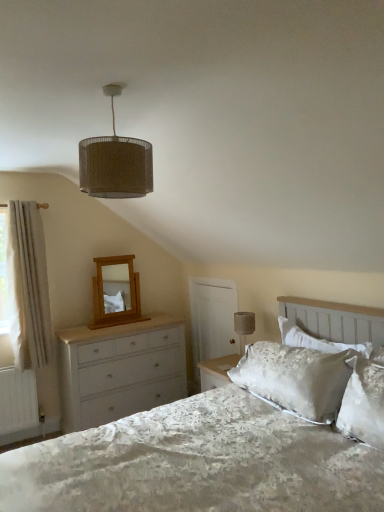
Question: Should I look upward or downward to see white fluffy curtain at left?

Choices:
 (A) up
 (B) down

Answer: (B)

Question: Is the position of light oak wooden mirror at upper left less distant than that of matte gray fabric at upper right?

Choices:
 (A) yes
 (B) no

Answer: (B)

Question: Considering the relative positions of light oak wooden mirror at upper left and matte gray fabric at upper right in the image provided, is light oak wooden mirror at upper left to the right of matte gray fabric at upper right from the viewer's perspective?

Choices:
 (A) yes
 (B) no

Answer: (B)

Question: From a real-world perspective, is light oak wooden mirror at upper left below matte gray fabric at upper right?

Choices:
 (A) no
 (B) yes

Answer: (A)

Question: From the image's perspective, is light oak wooden mirror at upper left on top of matte gray fabric at upper right?

Choices:
 (A) yes
 (B) no

Answer: (A)

Question: Is light oak wooden mirror at upper left facing towards matte gray fabric at upper right?

Choices:
 (A) yes
 (B) no

Answer: (A)

Question: Considering the relative sizes of light oak wooden mirror at upper left and matte gray fabric at upper right in the image provided, is light oak wooden mirror at upper left smaller than matte gray fabric at upper right?

Choices:
 (A) no
 (B) yes

Answer: (A)

Question: From a real-world perspective, does matte gray fabric at upper right stand above burlap lampshade at upper center?

Choices:
 (A) no
 (B) yes

Answer: (A)

Question: Can you confirm if matte gray fabric at upper right is bigger than burlap lampshade at upper center?

Choices:
 (A) no
 (B) yes

Answer: (A)

Question: Is matte gray fabric at upper right completely or partially outside of burlap lampshade at upper center?

Choices:
 (A) no
 (B) yes

Answer: (B)

Question: From the image's perspective, is matte gray fabric at upper right on top of burlap lampshade at upper center?

Choices:
 (A) yes
 (B) no

Answer: (B)

Question: Does matte gray fabric at upper right lie behind burlap lampshade at upper center?

Choices:
 (A) yes
 (B) no

Answer: (A)

Question: Is matte gray fabric at upper right turned away from burlap lampshade at upper center?

Choices:
 (A) yes
 (B) no

Answer: (B)

Question: From the image's perspective, would you say silky white pillow at upper right is positioned over white painted wood chest of drawers at left?

Choices:
 (A) no
 (B) yes

Answer: (B)